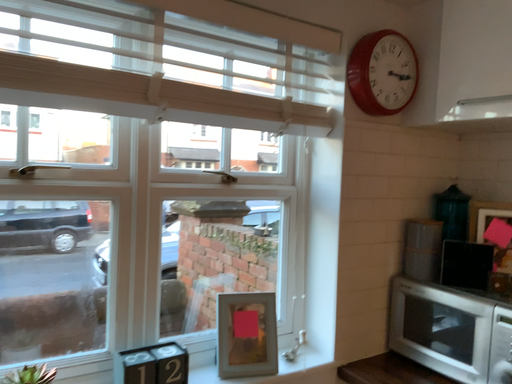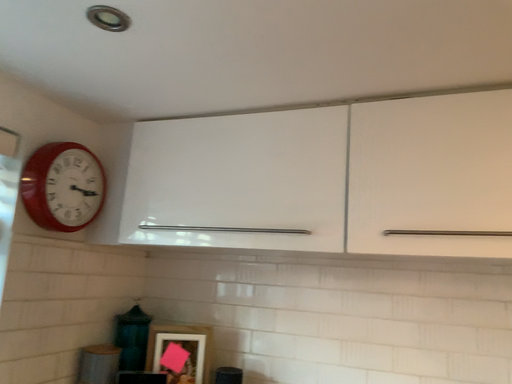
Question: How did the camera likely rotate when shooting the video?

Choices:
 (A) rotated upward
 (B) rotated downward

Answer: (A)